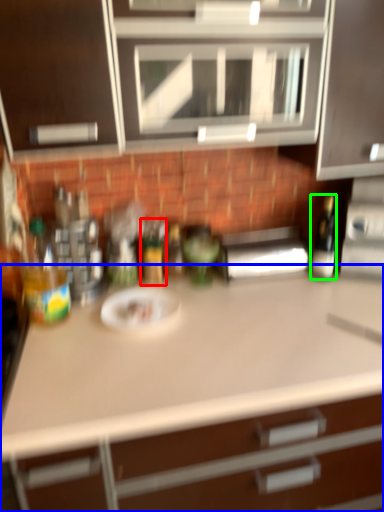
Question: Which object is the closest to the bottle (highlighted by a red box)? Choose among these: countertop (highlighted by a blue box) or bottle (highlighted by a green box).

Choices:
 (A) countertop
 (B) bottle

Answer: (B)